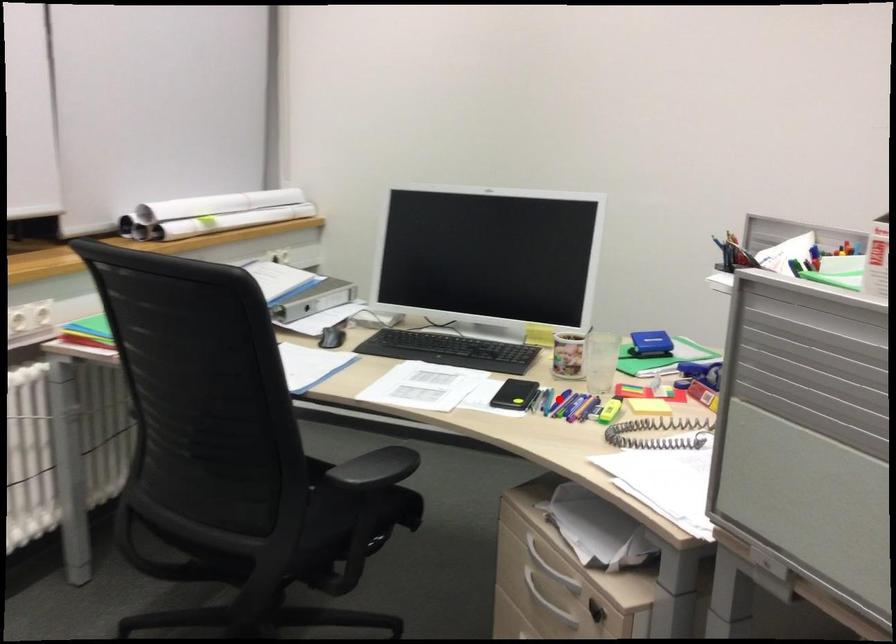
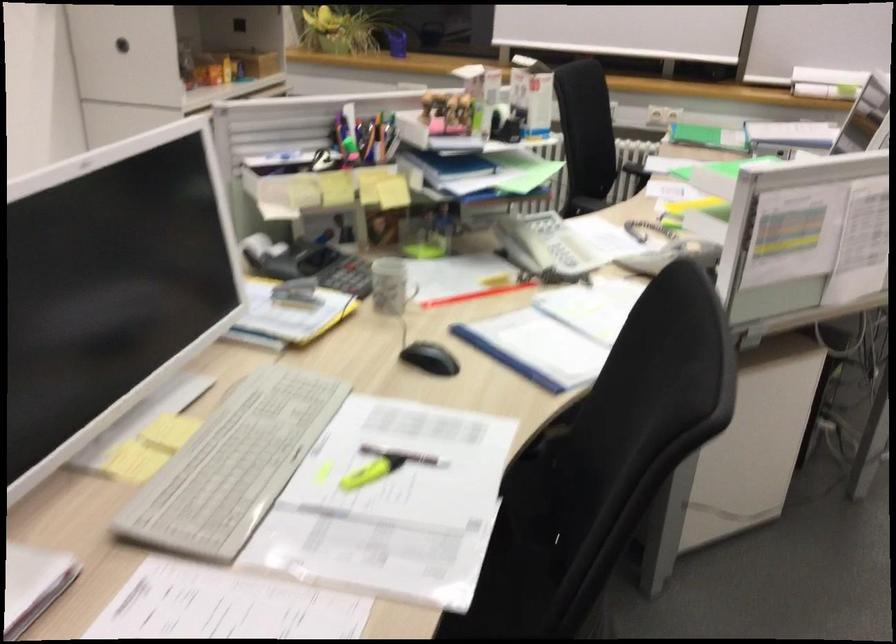
Question: I am providing you with two images of the same scene from different viewpoints. A red point is marked on the first image. Can you still see the location of the red point in image 2?

Choices:
 (A) Yes
 (B) No

Answer: (B)